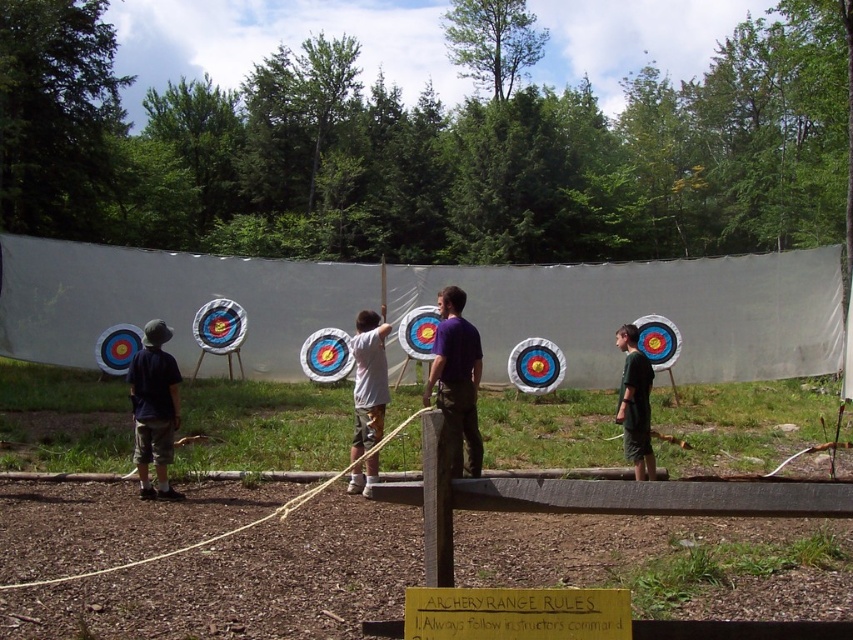
You are an archer standing at the back of the archery range. You see a dark blue shirt at left and a dark green shorts at center. Which object is wider from your viewpoint?

The dark blue shirt at left might be wider than dark green shorts at center according to the description.

You are standing at the center of the archery range and want to locate the dark blue shirt at left. Based on the coordinates provided, in which direction should you look to find it?

The dark blue shirt at left is located at coordinates point (154,408), which corresponds to the left side of the image. Therefore, you should look to your left to find it.